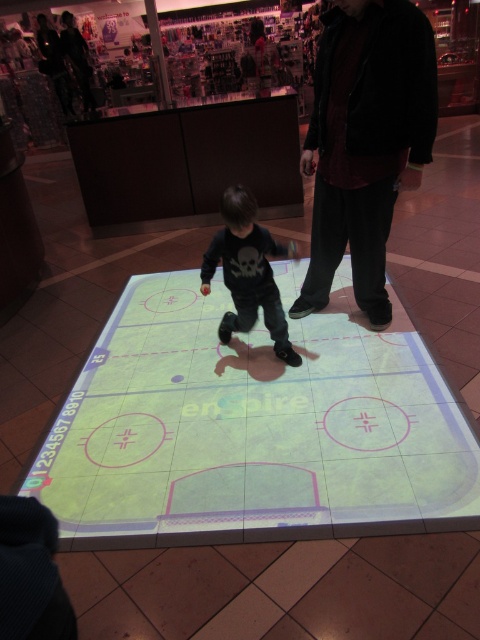
You are a customer in the store and want to pick up the dark red fabric jacket at center and the black matte shirt at center. Which one should you reach for first if you want to grab the one on the right?

The dark red fabric jacket at center is to the right of the black matte shirt at center, so you should reach for the dark red fabric jacket at center first.

You are navigating a virtual ice rink in the game. You need to move from point A to point B. Point A is at coordinates point (180, 288) and point B is at coordinates point (251, 212). Which direction should you move to reach point B from point A?

To move from point (180, 288) to point (251, 212), you should move upwards and to the left. This is because the y coordinate increases from 0.377 to 0.523, indicating an upward direction, while the x coordinate decreases from 0.450 to 0.334, meaning a leftward movement.